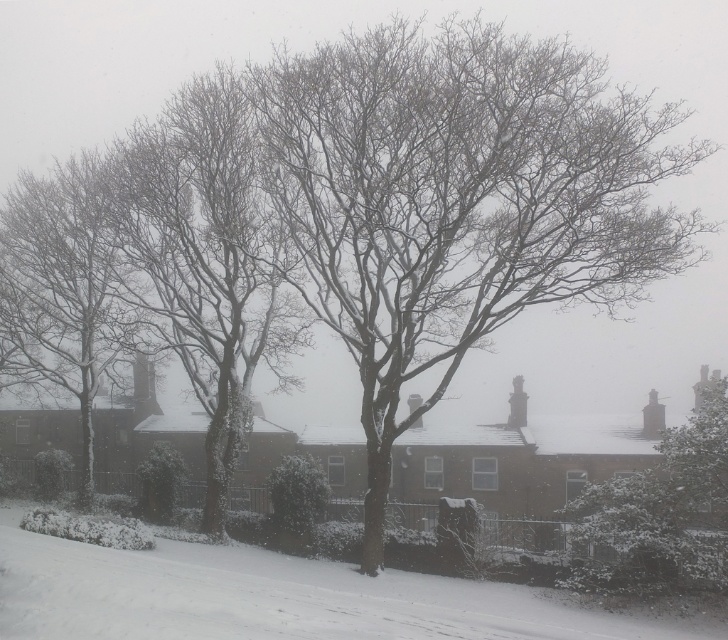
You are an observer looking at the winter scene. You notice the bare branches at center and the white fluffy snow at lower center. Which object is closer to you?

The bare branches at center are closer to you because the white fluffy snow at lower center is behind them.

You are an artist trying to paint the winter scene. You have to decide which area to focus on first between the bare branches at center and the white fluffy snow at lower center. Based on their sizes, which one should you start with?

The bare branches at center is larger in size than the white fluffy snow at lower center, so you should start with the bare branches at center first.